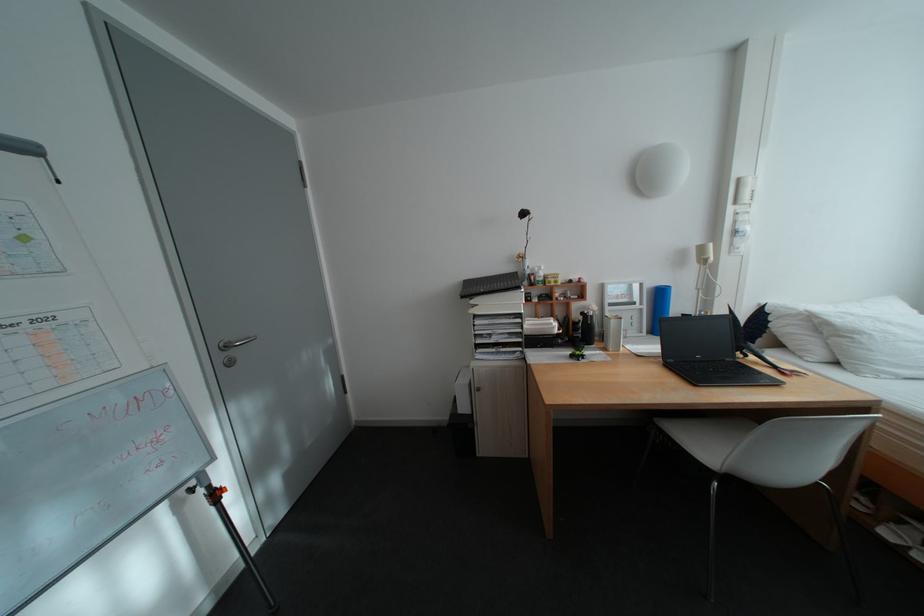
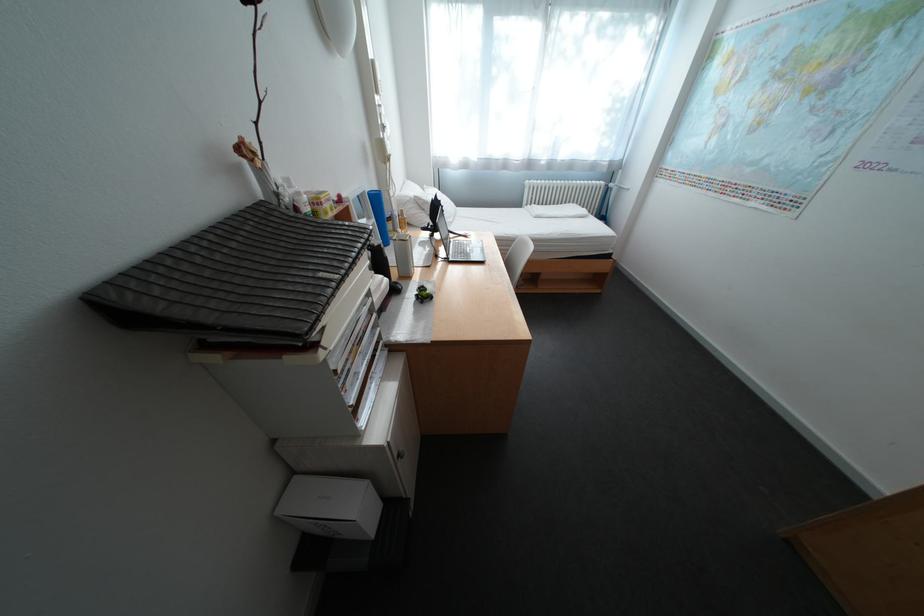
Locate, in the second image, the point that corresponds to [555,330] in the first image.

(395, 292)